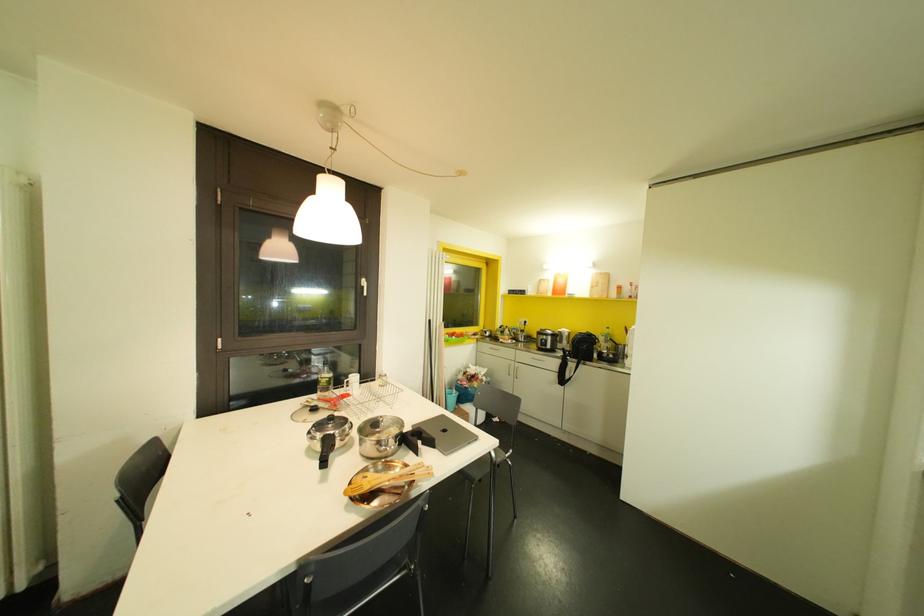
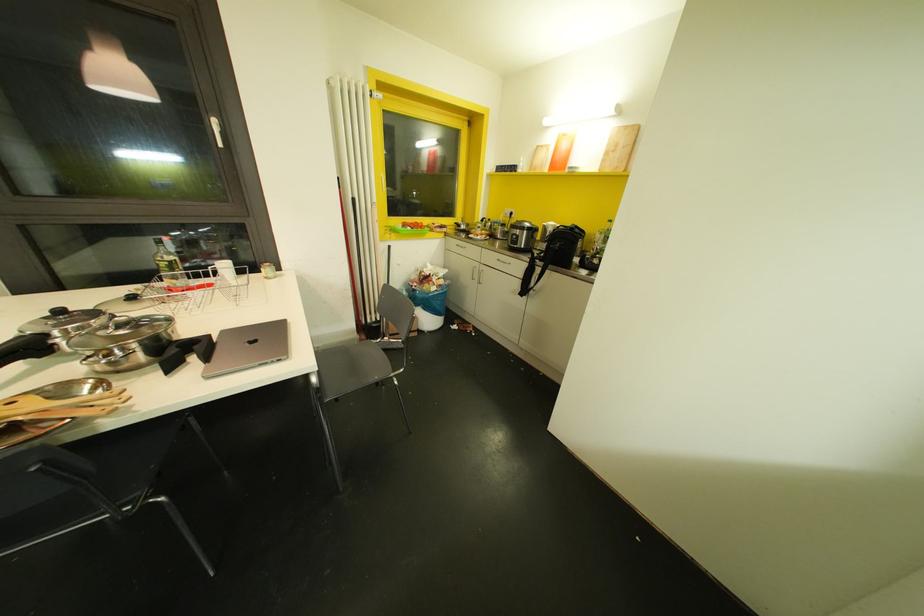
Where in the second image is the point corresponding to point (594, 296) from the first image?

(606, 169)